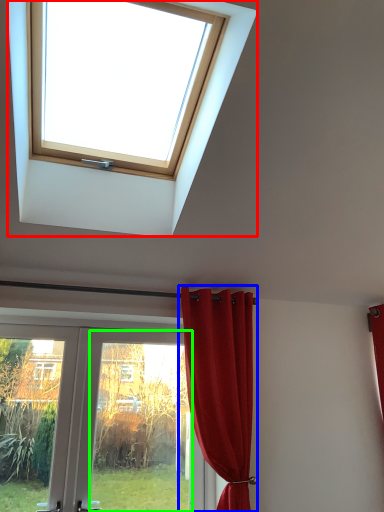
Question: Based on their relative distances, which object is farther from window (highlighted by a red box)? Choose from curtain (highlighted by a blue box) and glass door (highlighted by a green box).

Choices:
 (A) curtain
 (B) glass door

Answer: (B)